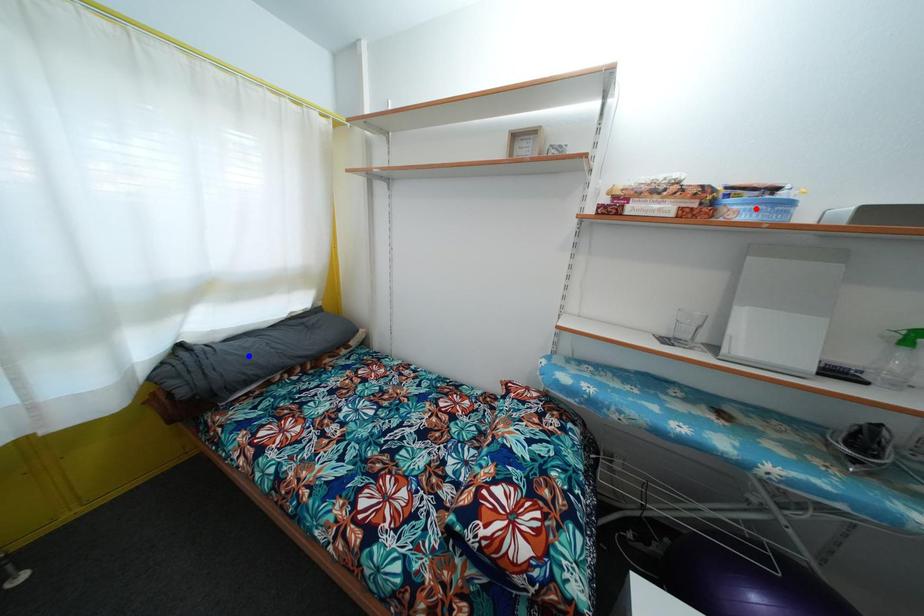
Question: Two points are marked on the image. Which point is closer to the camera?

Choices:
 (A) Blue point is closer.
 (B) Red point is closer.

Answer: (B)